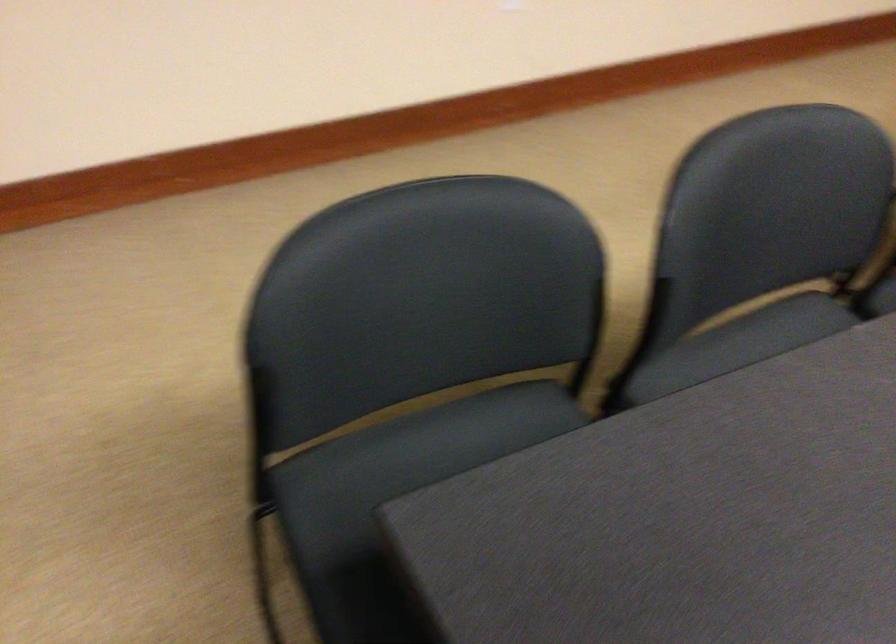
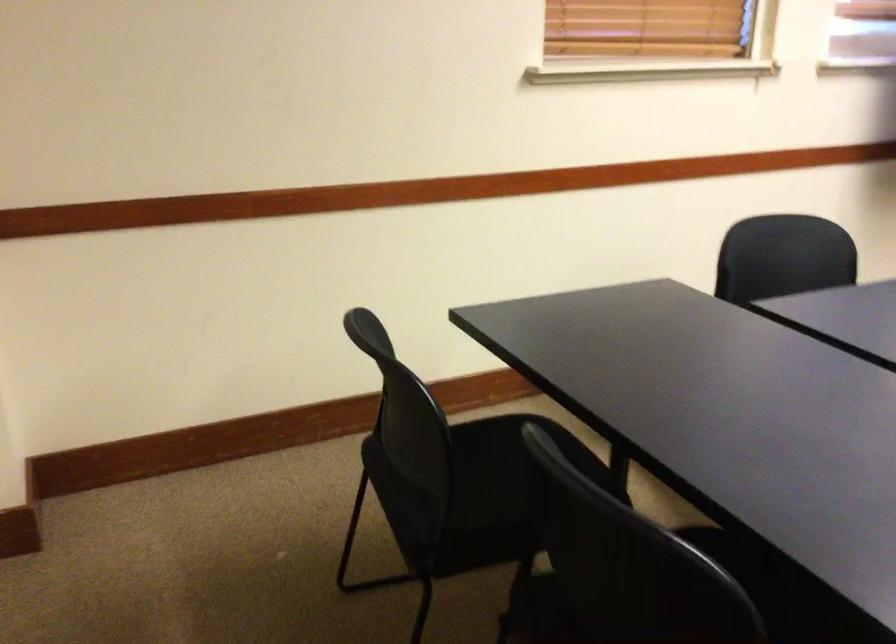
Question: What movement of the cameraman would produce the second image?

Choices:
 (A) Left
 (B) Right
 (C) Forward
 (D) Backward

Answer: (D)